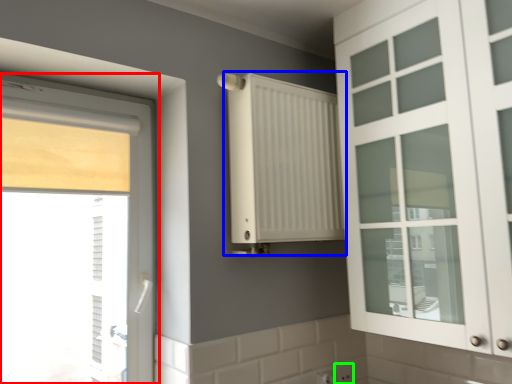
Question: Which object is the closest to the window (highlighted by a red box)? Choose among these: radiator (highlighted by a blue box) or electric outlet (highlighted by a green box).

Choices:
 (A) radiator
 (B) electric outlet

Answer: (A)